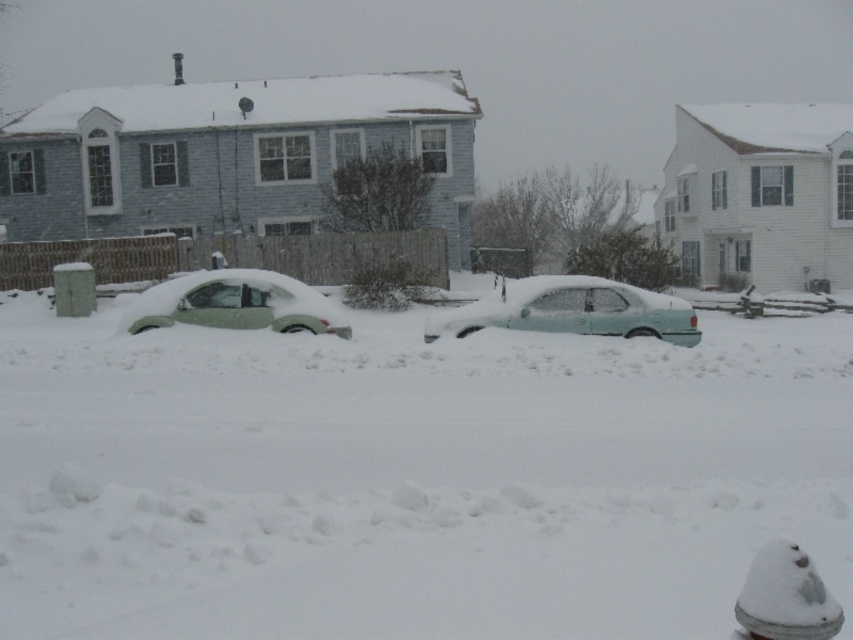
Is light blue matte car at center to the right of green matte car at left from the viewer's perspective?

Indeed, light blue matte car at center is positioned on the right side of green matte car at left.

This screenshot has width=853, height=640. Find the location of `light blue matte car at center`. light blue matte car at center is located at coordinates (572, 310).

Is point (503, 307) farther from viewer compared to point (229, 292)?

That is False.

Image resolution: width=853 pixels, height=640 pixels. Identify the location of light blue matte car at center. (572, 310).

Looking at this image, is white fluffy snow at center to the right of green matte car at left from the viewer's perspective?

Yes, white fluffy snow at center is to the right of green matte car at left.

Is white fluffy snow at center closer to camera compared to green matte car at left?

That is True.

Describe the element at coordinates (410, 477) in the screenshot. I see `white fluffy snow at center` at that location.

At what (x,y) coordinates should I click in order to perform the action: click on white fluffy snow at center. Please return your answer as a coordinate pair (x, y). The height and width of the screenshot is (640, 853). Looking at the image, I should click on (410, 477).

Does light blue matte car at center appear under white plastic hydrant at lower right?

No, light blue matte car at center is not below white plastic hydrant at lower right.

Between point (646, 296) and point (821, 630), which one is positioned in front?

Point (821, 630)

Identify the location of light blue matte car at center. (572, 310).